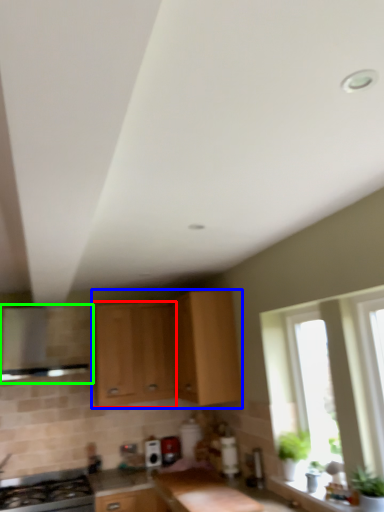
Question: Which object is positioned farthest from cabinetry (highlighted by a red box)? Select from cabinetry (highlighted by a blue box) and vent (highlighted by a green box).

Choices:
 (A) cabinetry
 (B) vent

Answer: (B)